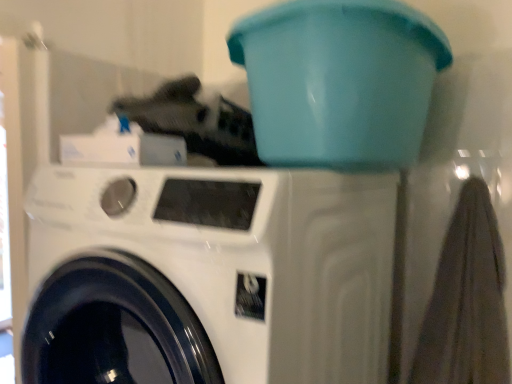
Question: From the image's perspective, is teal plastic bucket at upper center beneath white glossy washing machine at center?

Choices:
 (A) no
 (B) yes

Answer: (A)

Question: Could you tell me if teal plastic bucket at upper center is turned towards white glossy washing machine at center?

Choices:
 (A) yes
 (B) no

Answer: (B)

Question: Considering the relative sizes of teal plastic bucket at upper center and white glossy washing machine at center in the image provided, is teal plastic bucket at upper center bigger than white glossy washing machine at center?

Choices:
 (A) no
 (B) yes

Answer: (A)

Question: Does teal plastic bucket at upper center have a smaller size compared to white glossy washing machine at center?

Choices:
 (A) yes
 (B) no

Answer: (A)

Question: From a real-world perspective, is teal plastic bucket at upper center physically above white glossy washing machine at center?

Choices:
 (A) no
 (B) yes

Answer: (B)

Question: Can you confirm if teal plastic bucket at upper center is shorter than white glossy washing machine at center?

Choices:
 (A) yes
 (B) no

Answer: (A)

Question: Is white glossy washing machine at center smaller than teal plastic bucket at upper center?

Choices:
 (A) yes
 (B) no

Answer: (B)

Question: Can you confirm if white glossy washing machine at center is thinner than teal plastic bucket at upper center?

Choices:
 (A) yes
 (B) no

Answer: (B)

Question: From the image's perspective, is white glossy washing machine at center below teal plastic bucket at upper center?

Choices:
 (A) no
 (B) yes

Answer: (B)

Question: Is white glossy washing machine at center positioned behind teal plastic bucket at upper center?

Choices:
 (A) no
 (B) yes

Answer: (A)

Question: Are white glossy washing machine at center and teal plastic bucket at upper center located far from each other?

Choices:
 (A) no
 (B) yes

Answer: (A)

Question: Is white glossy washing machine at center at the right side of teal plastic bucket at upper center?

Choices:
 (A) no
 (B) yes

Answer: (A)

Question: From a real-world perspective, relative to white glossy washing machine at center, is teal plastic bucket at upper center vertically above or below?

Choices:
 (A) below
 (B) above

Answer: (B)